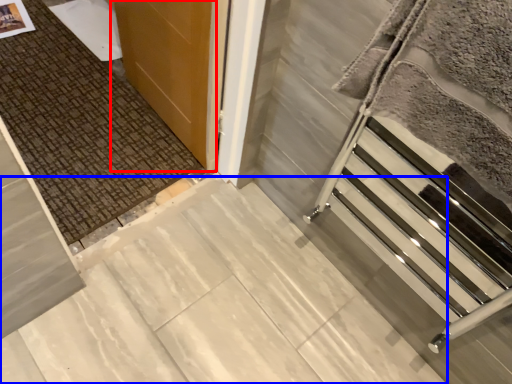
Question: Among these objects, which one is nearest to the camera, door (highlighted by a red box) or concrete (highlighted by a blue box)?

Choices:
 (A) door
 (B) concrete

Answer: (B)